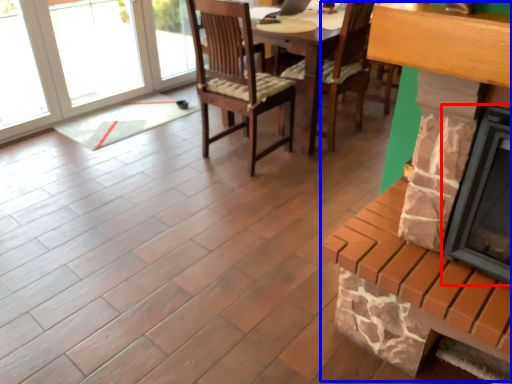
Question: Among these objects, which one is nearest to the camera, fireplace (highlighted by a red box) or fireplace (highlighted by a blue box)?

Choices:
 (A) fireplace
 (B) fireplace

Answer: (A)